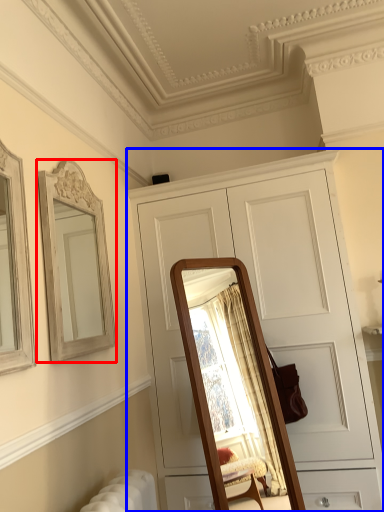
Question: Among these objects, which one is farthest to the camera, mirror (highlighted by a red box) or cabinetry (highlighted by a blue box)?

Choices:
 (A) mirror
 (B) cabinetry

Answer: (B)